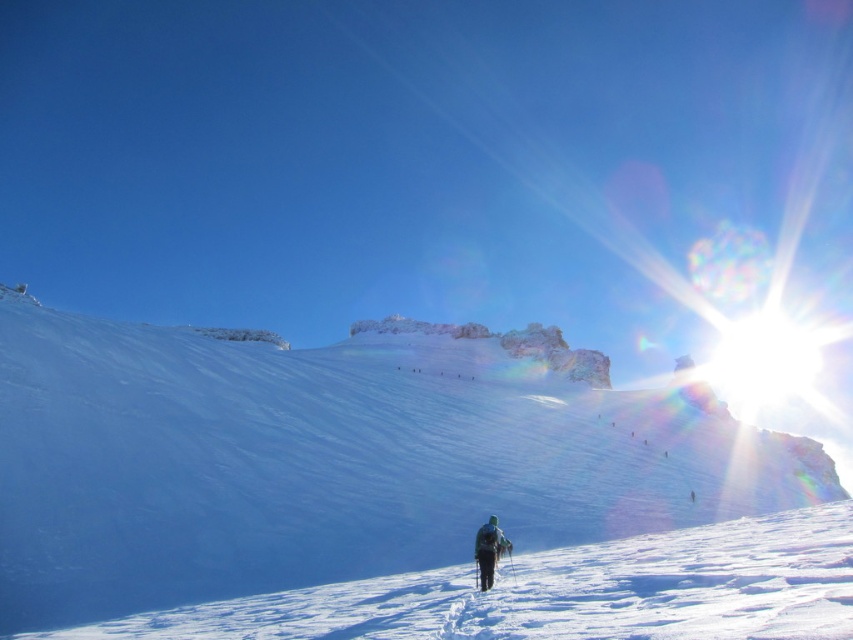
You are a hiker planning to cross the snowfield from the dark green fabric jacket at lower center to the white powdery snow at center. Given that your maximum safe distance per trip is 50 meters, can you safely make this journey in one go?

The distance between the dark green fabric jacket at lower center and the white powdery snow at center is 66.64 meters, which exceeds your maximum safe distance of 50 meters. Therefore, you cannot safely make this journey in one go.

You are standing at the point marked by the coordinates in the image and want to walk towards the rocky outcrop in the background. Which direction should you move relative to the white powdery snow at center located at point (x=334, y=458)?

The white powdery snow at center is located at point (x=334, y=458). Since the rocky outcrop is in the background and the slope leads up to it, you should move forward from the white powdery snow at center towards the direction of the rocky outcrop.